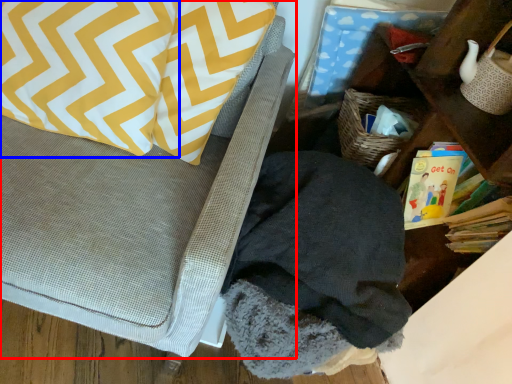
Question: Which point is closer to the camera, furniture (highlighted by a red box) or pillow (highlighted by a blue box)?

Choices:
 (A) furniture
 (B) pillow

Answer: (A)